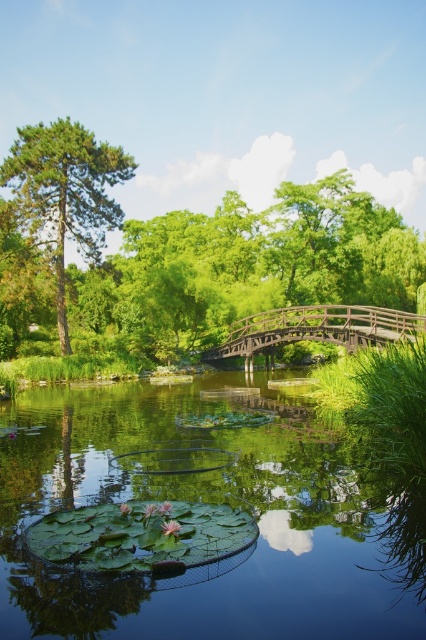
Question: Is green leafy water at center smaller than green matte tree at left?

Choices:
 (A) no
 (B) yes

Answer: (B)

Question: Which point is closer to the camera taking this photo?

Choices:
 (A) (20, 136)
 (B) (176, 269)

Answer: (A)

Question: Which of these objects is positioned farthest from the green leafy water at center?

Choices:
 (A) wooden bridge at center
 (B) green textured pine tree at upper left

Answer: (B)

Question: Which object is farther from the camera taking this photo?

Choices:
 (A) wooden bridge at center
 (B) green textured pine tree at upper left

Answer: (B)

Question: Does green leafy water at center appear on the right side of wooden bridge at center?

Choices:
 (A) yes
 (B) no

Answer: (B)

Question: Does green textured pine tree at upper left appear under wooden bridge at center?

Choices:
 (A) yes
 (B) no

Answer: (B)